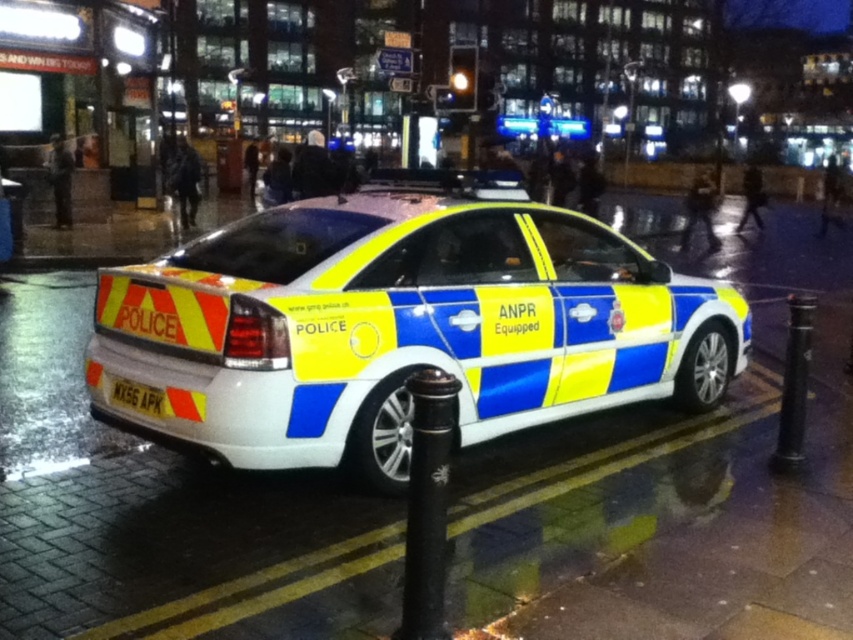
You are a pedestrian standing at the camera position looking at the police car. Which of the two points, point (438, 573) or point (137, 401), is closer to you?

Point (438, 573) is closer to the camera than point (137, 401).

You are a pedestrian standing at the point closest to the police car. Which point, point (630, 342) or point (436, 584), is closer to you?

Point (436, 584) is closer to you because it is in front of point (630, 342).